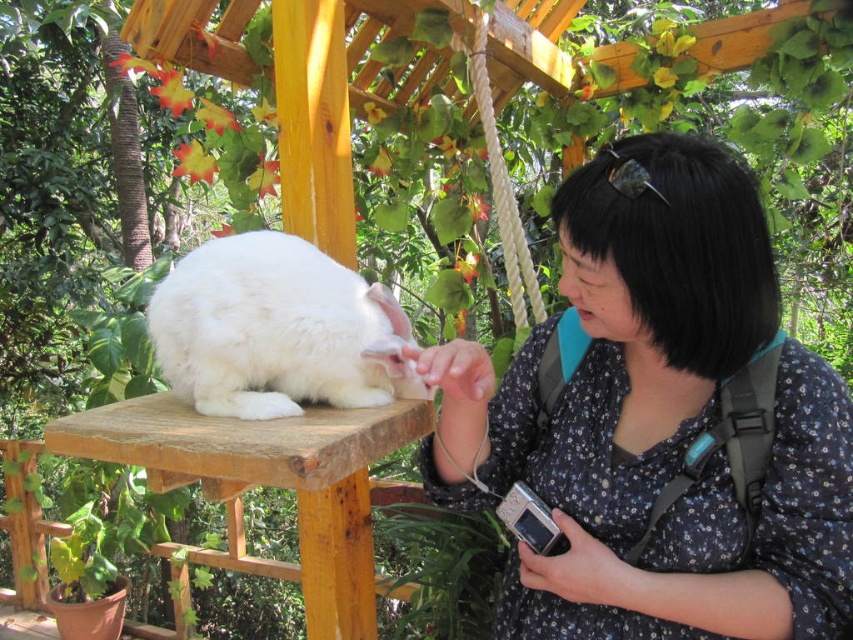
Which is in front, point (608, 172) or point (244, 284)?

Point (608, 172)

Does point (587, 212) come closer to viewer compared to point (302, 237)?

Yes, it is in front of point (302, 237).

Image resolution: width=853 pixels, height=640 pixels. Identify the location of floral print blouse at center. tap(654, 420).

Locate an element on the screen. Image resolution: width=853 pixels, height=640 pixels. floral print blouse at center is located at coordinates (654, 420).

Between floral print blouse at center and wooden stool at center, which one has less height?

With less height is wooden stool at center.

Between point (605, 522) and point (219, 465), which one is positioned in front?

Positioned in front is point (219, 465).

Locate an element on the screen. This screenshot has height=640, width=853. floral print blouse at center is located at coordinates (654, 420).

How much distance is there between white fluffy rabbit at center and wooden stool at center?

They are 4.91 inches apart.

Who is taller, white fluffy rabbit at center or wooden stool at center?

white fluffy rabbit at center is taller.

Which is behind, point (386, 292) or point (187, 481)?

The point (386, 292) is more distant.

Find the location of a particular element. This screenshot has height=640, width=853. white fluffy rabbit at center is located at coordinates (276, 330).